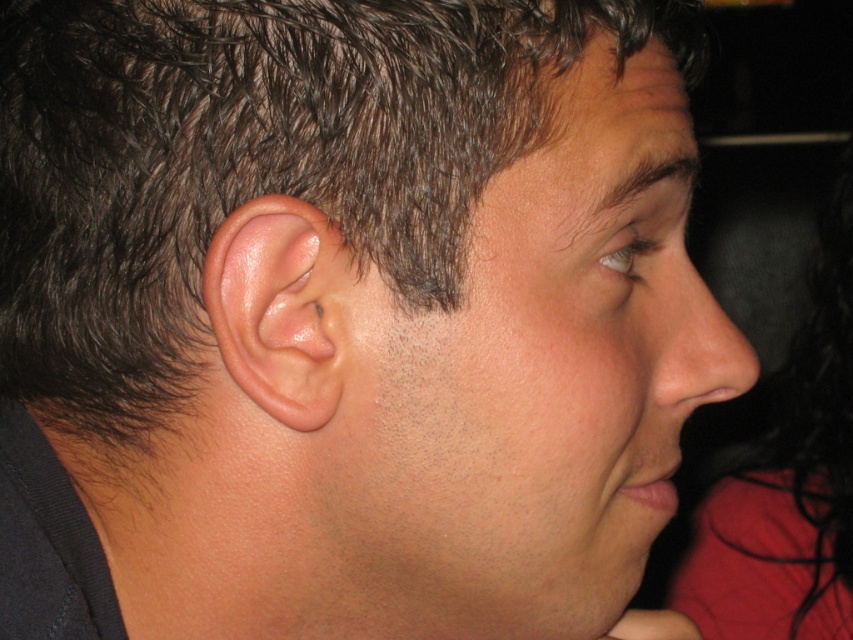
Question: Which point is closer to the camera?

Choices:
 (A) pink flesh/soft tissue ear at center
 (B) dark red hair at right
 (C) dark brown hair at upper left
 (D) smooth skin nose at center

Answer: (C)

Question: Estimate the real-world distances between objects in this image. Which object is farther from the pink flesh/soft tissue ear at center?

Choices:
 (A) dark red hair at right
 (B) dark brown hair at upper left

Answer: (A)

Question: Is smooth skin face at center to the right of pink flesh/soft tissue ear at center from the viewer's perspective?

Choices:
 (A) no
 (B) yes

Answer: (B)

Question: Where is dark brown hair at upper left located in relation to pink flesh/soft tissue ear at center in the image?

Choices:
 (A) above
 (B) below

Answer: (A)

Question: Is smooth skin face at center further to the viewer compared to dark red hair at right?

Choices:
 (A) no
 (B) yes

Answer: (A)

Question: Estimate the real-world distances between objects in this image. Which object is closer to the smooth skin nose at center?

Choices:
 (A) dark red hair at right
 (B) pink flesh/soft tissue ear at center
 (C) dark brown hair at upper left
 (D) smooth skin face at center

Answer: (D)